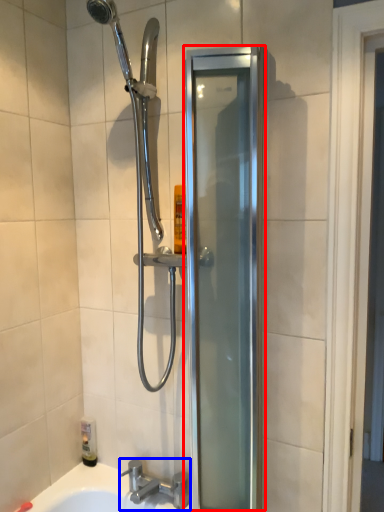
Question: Among these objects, which one is farthest to the camera, screen door (highlighted by a red box) or tap (highlighted by a blue box)?

Choices:
 (A) screen door
 (B) tap

Answer: (B)